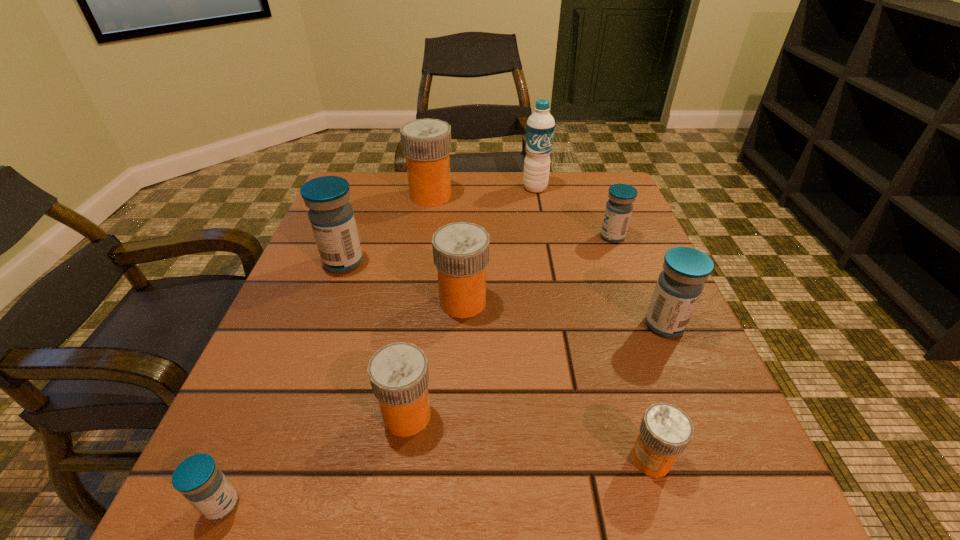
Identify which blue medicine is the second closest to the second smallest orange medicine. Please provide its 2D coordinates. Your answer should be formatted as a tuple, i.e. [(x, y)], where the tuple contains the x and y coordinates of a point satisfying the conditions above.

[(332, 219)]

Locate an element on the screen. blue medicine that is the closest to the smallest orange medicine is located at coordinates (681, 282).

Find the location of a particular element. free region that satisfies the following two spatial constraints: 1. on the label of the tallest object; 2. on the label side of the second farthest orange medicine is located at coordinates (556, 302).

The width and height of the screenshot is (960, 540). What are the coordinates of `vacant space that satisfies the following two spatial constraints: 1. on the label side of the second biggest orange medicine; 2. on the right side of the second biggest blue medicine` in the screenshot? It's located at (462, 325).

Where is `vacant space that satisfies the following two spatial constraints: 1. on the label of the sixth object from left to right; 2. on the left side of the second biggest blue medicine`? This screenshot has width=960, height=540. vacant space that satisfies the following two spatial constraints: 1. on the label of the sixth object from left to right; 2. on the left side of the second biggest blue medicine is located at coordinates (561, 325).

Identify the location of vacant space that satisfies the following two spatial constraints: 1. on the label side of the second nearest blue medicine; 2. on the left side of the third smallest orange medicine. The height and width of the screenshot is (540, 960). (462, 325).

This screenshot has height=540, width=960. What are the coordinates of `free space that satisfies the following two spatial constraints: 1. on the label of the water bottle; 2. on the left side of the second smallest blue medicine` in the screenshot? It's located at (544, 237).